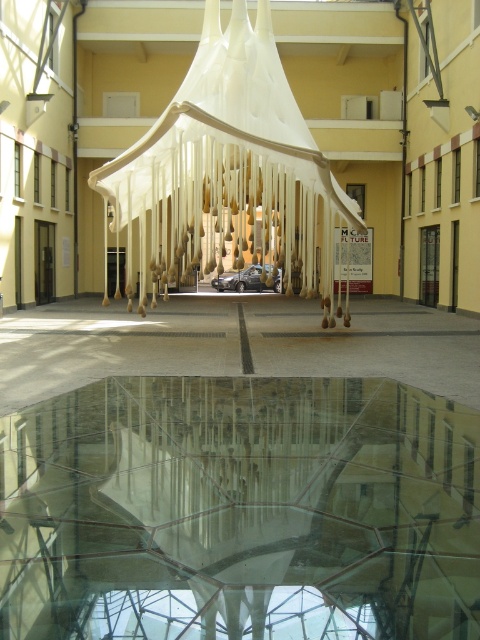
In the scene shown: You are standing in the courtyard and want to place a small potted plant on the transparent glass table at center. The point where you want to place it is at coordinates point (240,512). Is this point on the table?

Yes, the point (240,512) is on the transparent glass table at center, so placing the potted plant there is possible.

You are standing in the courtyard and want to place a small potted plant on the transparent glass table at center. However, you notice the white fabric canopy bed at center is nearby. Is the glass table to the left or right of the canopy bed?

The transparent glass table at center is positioned on the right side of the white fabric canopy bed at center, so the glass table is to the right of the canopy bed.

You are planning to place a 2.5 meter wide sofa in the courtyard. Given the space between the transparent glass table at center and the white fabric canopy bed at center, will the sofa fit between them?

The transparent glass table at center has a lesser width compared to white fabric canopy bed at center. However, the exact distance between them isn not provided in the description. Therefore, it is uncertain whether the 2.5 meter wide sofa will fit between them.